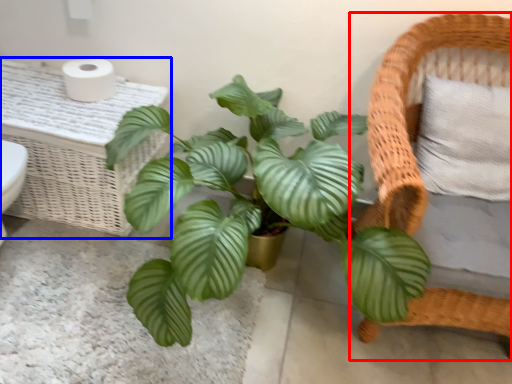
Question: Among these objects, which one is nearest to the camera, furniture (highlighted by a red box) or table (highlighted by a blue box)?

Choices:
 (A) furniture
 (B) table

Answer: (A)